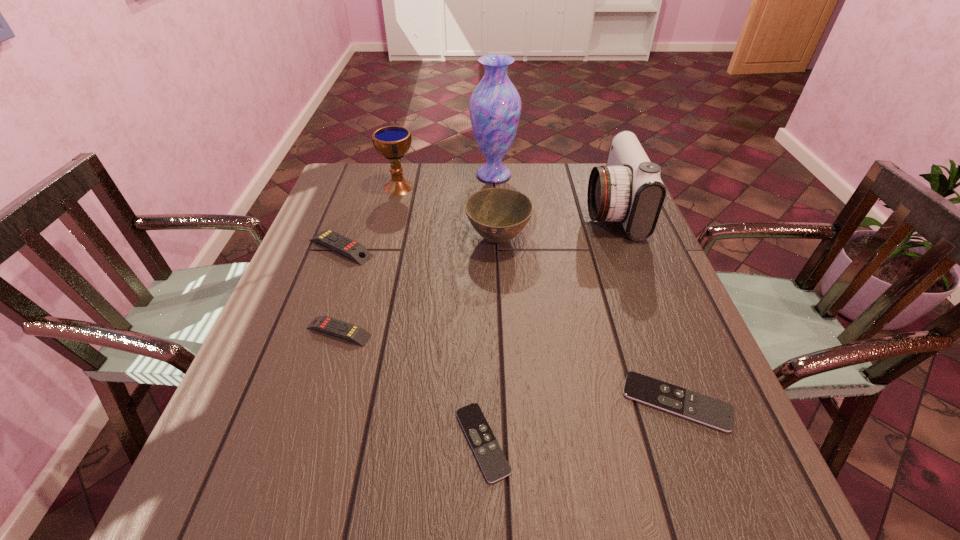
Where is `free space between the chalice and the fifth shortest object`? free space between the chalice and the fifth shortest object is located at coordinates (448, 213).

You are a GUI agent. You are given a task and a screenshot of the screen. Output one action in this format:
    pyautogui.click(x=<x>, y=<y>)
    Task: Click on the free spot between the blue chalice and the left black remote control
    
    Given the screenshot: What is the action you would take?
    pyautogui.click(x=441, y=314)

Where is `empty space between the rightmost remote control and the camcorder`? The width and height of the screenshot is (960, 540). empty space between the rightmost remote control and the camcorder is located at coordinates (644, 306).

Find the location of a particular element. The height and width of the screenshot is (540, 960). empty space that is in between the bowl and the camcorder is located at coordinates (555, 225).

Locate an element on the screen. This screenshot has width=960, height=540. vacant region between the blue chalice and the farthest remote control is located at coordinates (370, 218).

The width and height of the screenshot is (960, 540). I want to click on free space that is in between the smaller black remote control and the sixth tallest object, so click(411, 387).

Choose which object is the third nearest neighbor to the fifth shortest object. Please provide its 2D coordinates. Your answer should be formatted as a tuple, i.e. [(x, y)], where the tuple contains the x and y coordinates of a point satisfying the conditions above.

[(392, 142)]

Find the location of a particular element. the sixth closest object relative to the shortest remote control is located at coordinates (392, 142).

Locate which remote control ranks third in proximity to the bigger black remote control. Please provide its 2D coordinates. Your answer should be formatted as a tuple, i.e. [(x, y)], where the tuple contains the x and y coordinates of a point satisfying the conditions above.

[(357, 252)]

Locate which remote control is the third closest to the smaller yellow remote control. Please provide its 2D coordinates. Your answer should be formatted as a tuple, i.e. [(x, y)], where the tuple contains the x and y coordinates of a point satisfying the conditions above.

[(706, 410)]